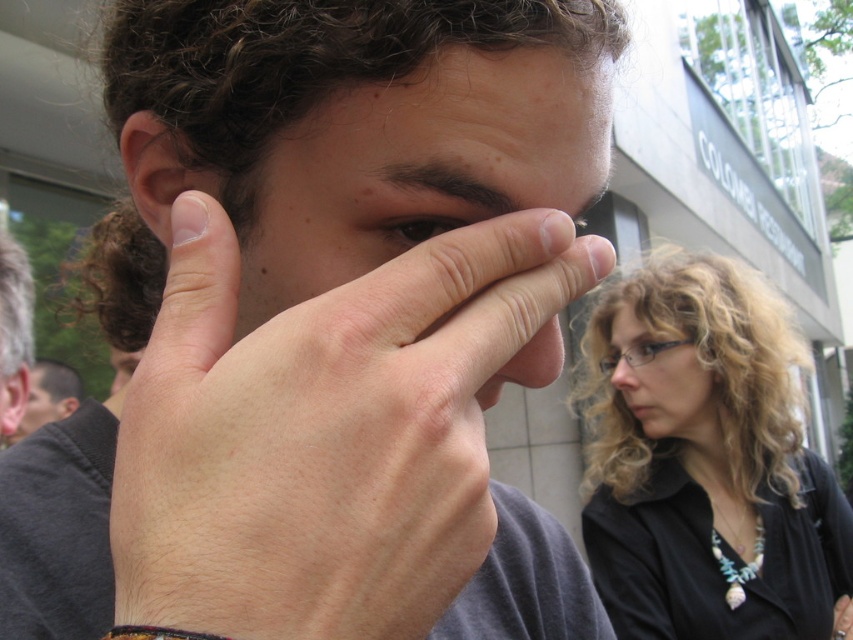
Question: Considering the real-world distances, which object is closest to the brown matte eye at center?

Choices:
 (A) matte skin face at center
 (B) black matte shirt at lower right

Answer: (A)

Question: Does black matte shirt at lower right appear under matte black hair at lower left?

Choices:
 (A) no
 (B) yes

Answer: (B)

Question: Which is nearer to the pale skin/hair at center?

Choices:
 (A) smooth skin face at lower right
 (B) gray hair at left

Answer: (B)

Question: Is black matte shirt at lower right in front of brown matte eye at center?

Choices:
 (A) yes
 (B) no

Answer: (B)

Question: Which point is closer to the camera?

Choices:
 (A) brown matte eye at center
 (B) matte skin face at center

Answer: (B)

Question: Is gray hair at left below brown matte eye at center?

Choices:
 (A) yes
 (B) no

Answer: (A)